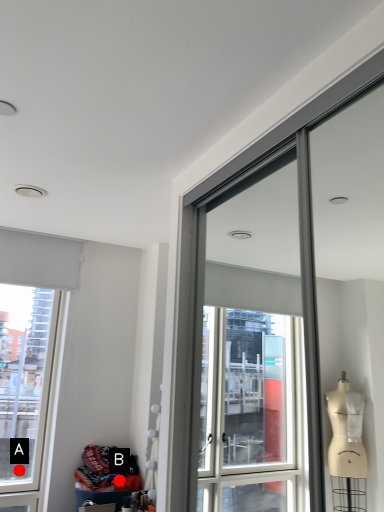
Question: Two points are circled on the image, labeled by A and B beside each circle. Which of the following is the farthest from the observer?

Choices:
 (A) A is further
 (B) B is further

Answer: (A)